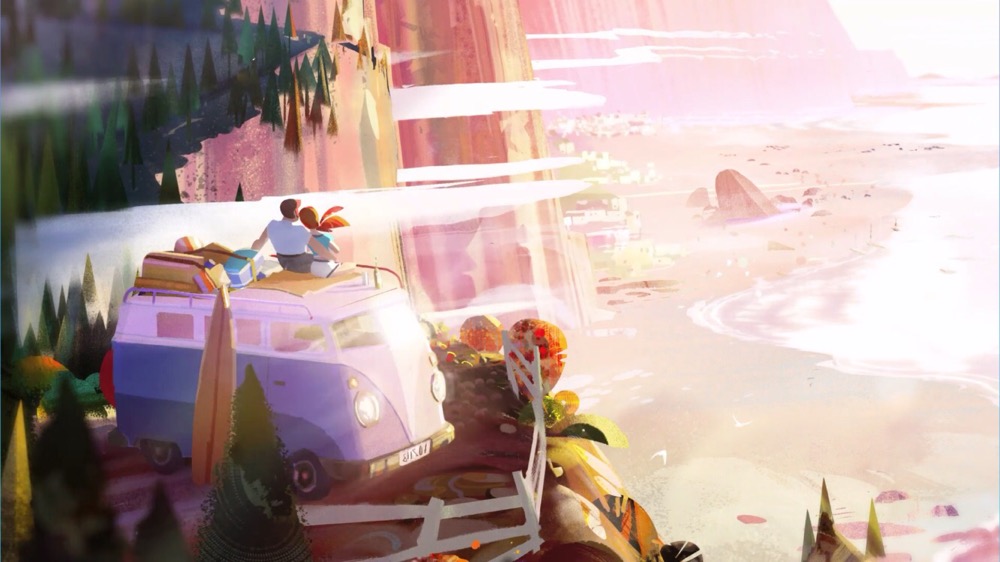
Where is `window`? window is located at coordinates (178, 324), (246, 337), (210, 326), (300, 343).